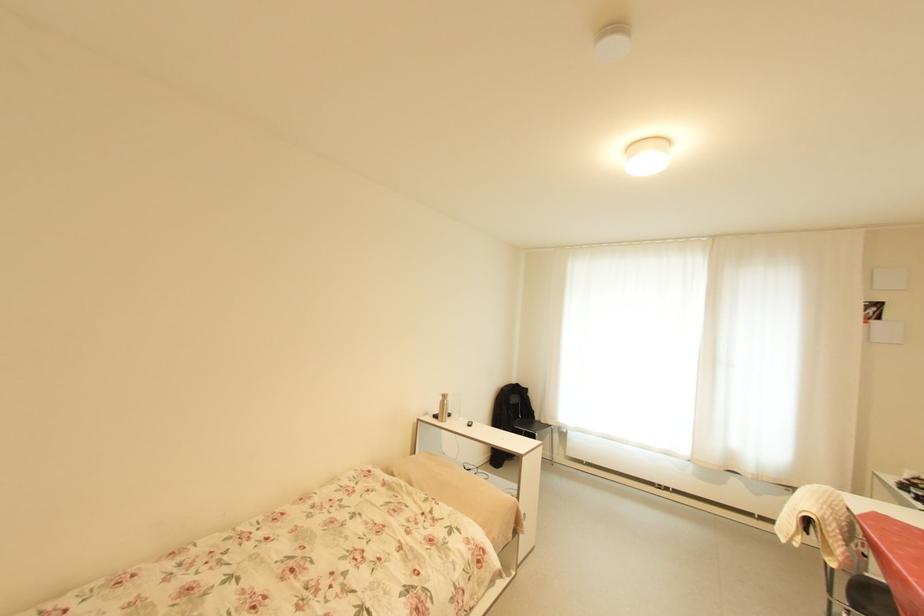
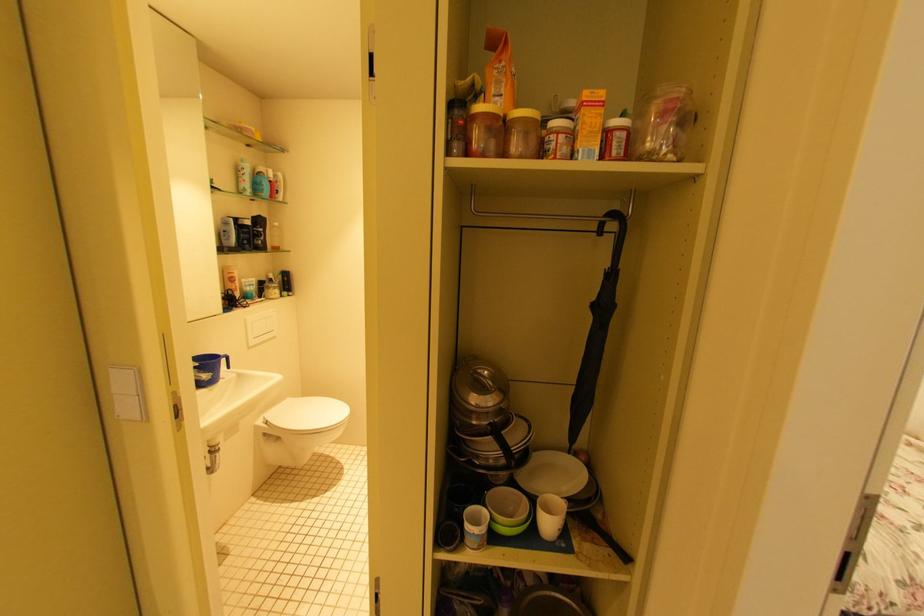
Question: Based on the continuous images, in which direction is the camera rotating? Reply with the corresponding letter.

Choices:
 (A) Left
 (B) Right
 (C) Up
 (D) Down

Answer: (A)